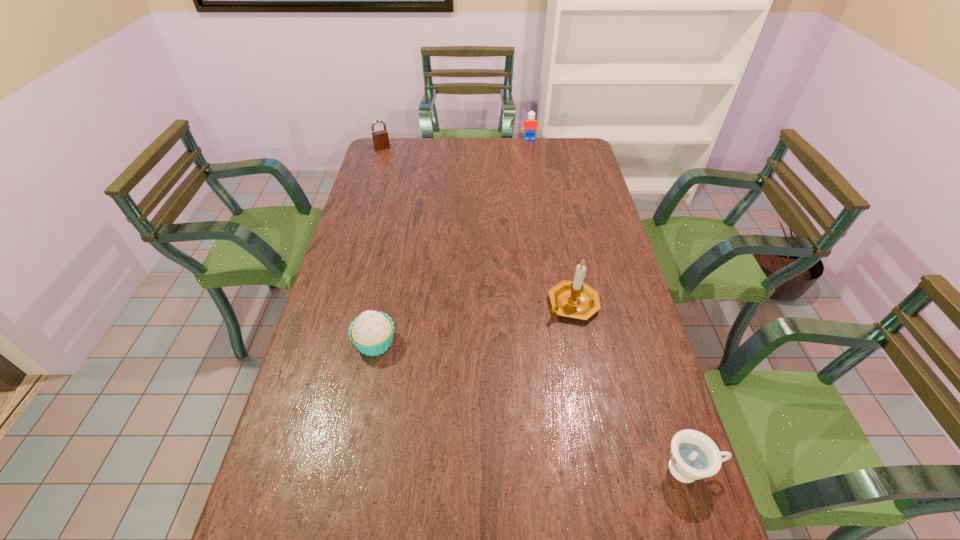
Identify the location of free space at the right edge of the desktop. This screenshot has width=960, height=540. (566, 174).

In the image, there is a desktop. Where is `vacant space at the far left corner`? vacant space at the far left corner is located at coordinates (392, 146).

Find the location of a particular element. This screenshot has height=540, width=960. empty location between the fourth object from right to left and the Lego is located at coordinates (452, 241).

The width and height of the screenshot is (960, 540). Find the location of `vacant point located between the padlock and the fourth object from right to left`. vacant point located between the padlock and the fourth object from right to left is located at coordinates (379, 245).

Locate an element on the screen. The height and width of the screenshot is (540, 960). free area in between the leftmost object and the second object from left to right is located at coordinates (379, 245).

Where is `empty space that is in between the farthest object and the second object from left to right`? empty space that is in between the farthest object and the second object from left to right is located at coordinates (452, 241).

At what (x,y) coordinates should I click in order to perform the action: click on free space between the third farthest object and the fourth object from right to left. Please return your answer as a coordinate pair (x, y). Looking at the image, I should click on (474, 323).

Locate an element on the screen. This screenshot has width=960, height=540. free area in between the cupcake and the rightmost object is located at coordinates (533, 406).

Image resolution: width=960 pixels, height=540 pixels. In order to click on vacant space that is in between the teacup and the candle holder in this screenshot , I will do `click(631, 387)`.

This screenshot has height=540, width=960. Find the location of `empty location between the second farthest object and the candle holder`. empty location between the second farthest object and the candle holder is located at coordinates (477, 226).